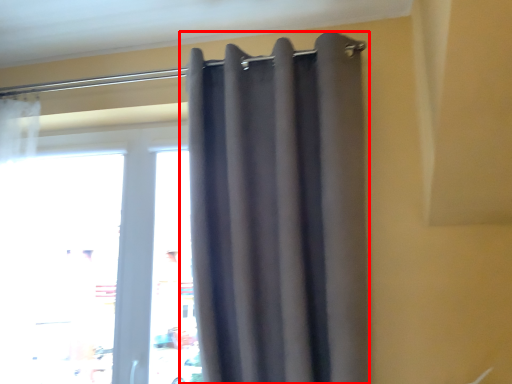
Question: In this image, where is curtain (annotated by the red box) located relative to window?

Choices:
 (A) left
 (B) right

Answer: (B)